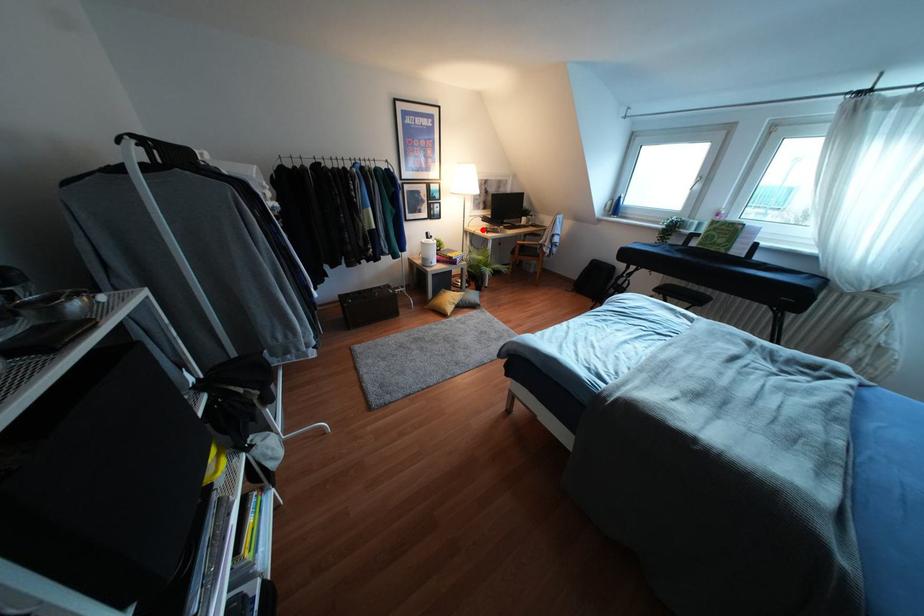
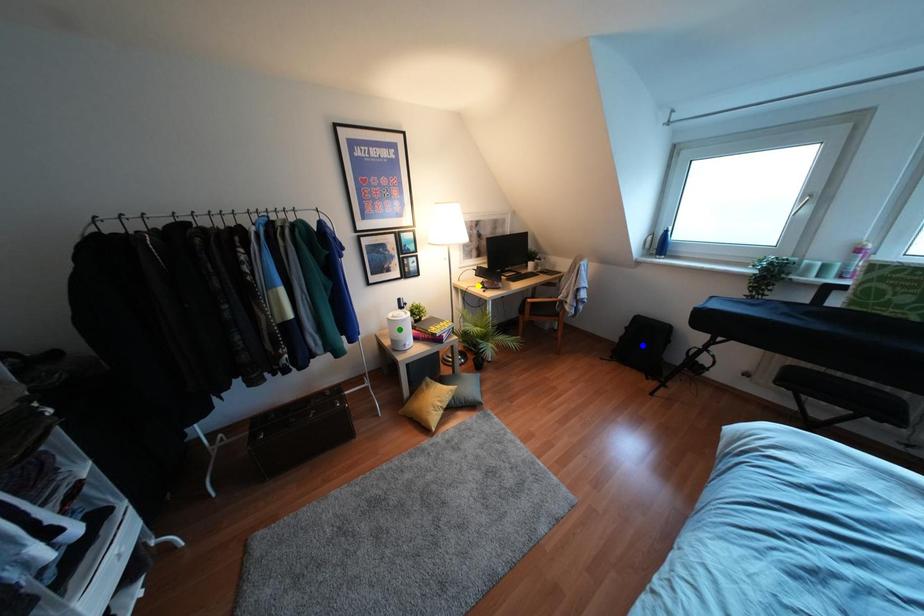
Question: I am providing you with two images of the same scene from different viewpoints. A red point is marked on the first image. You are given multiple points on the second image. Which point in image 2 is actually the same real-world point as the red point in image 1?

Choices:
 (A) yellow point
 (B) green point
 (C) blue point

Answer: (A)